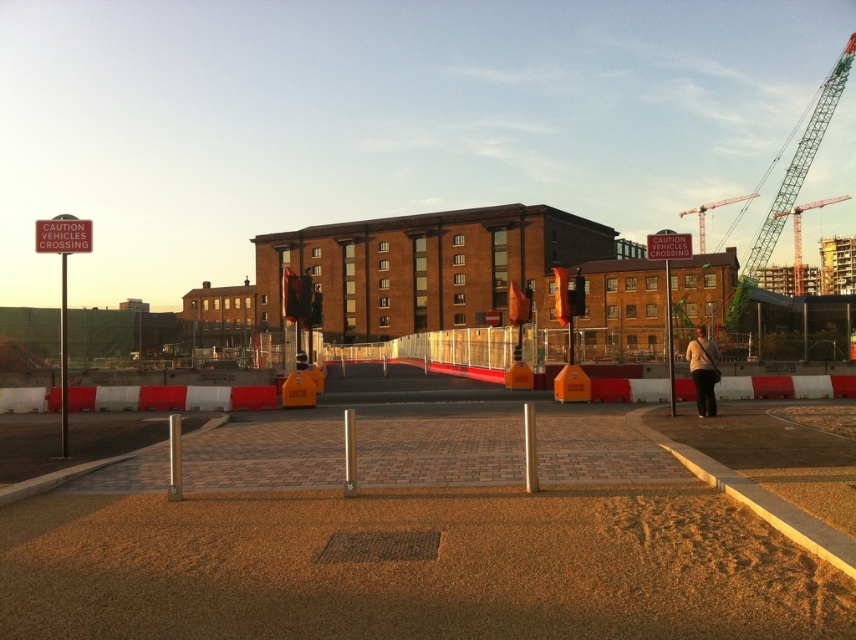
Question: Which object is the farthest from the green metal crane at upper right?

Choices:
 (A) red plastic sign at upper center
 (B) red plastic sign at upper left
 (C) green metallic crane at upper right
 (D) red plastic sign at left

Answer: (B)

Question: Is green metal crane at upper right positioned before light brown leather jacket at center?

Choices:
 (A) no
 (B) yes

Answer: (A)

Question: Does red plastic sign at left have a greater width compared to light brown leather jacket at center?

Choices:
 (A) yes
 (B) no

Answer: (A)

Question: In this image, where is red plastic sign at upper left located relative to red plastic sign at upper center?

Choices:
 (A) above
 (B) below

Answer: (A)

Question: Which point is farther from the camera taking this photo?

Choices:
 (A) (675, 241)
 (B) (64, 394)
 (C) (704, 400)
 (D) (812, 148)

Answer: (D)

Question: Which point is closer to the camera taking this photo?

Choices:
 (A) (755, 193)
 (B) (782, 204)

Answer: (B)